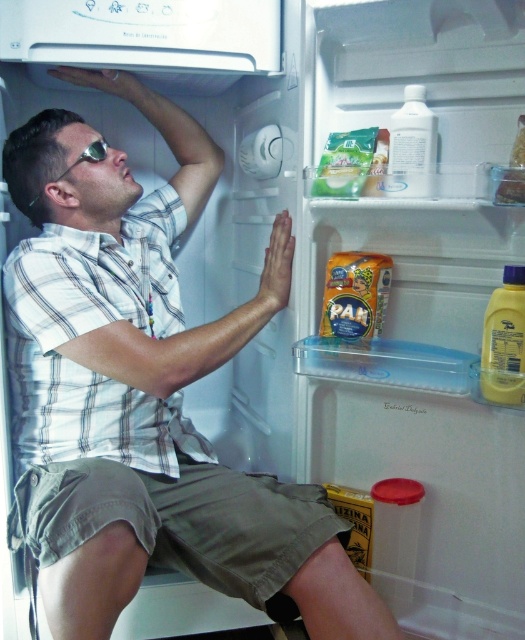
Which is in front, point (351, 276) or point (491, 358)?

Point (491, 358) is in front.

Which is more to the left, yellow matte pan at center or yellow plastic bottle at right?

yellow matte pan at center

Is point (383, 282) positioned before point (512, 394)?

No, it is not.

Locate an element on the screen. The image size is (525, 640). yellow matte pan at center is located at coordinates (355, 294).

Between point (519, 312) and point (97, 145), which one is positioned in front?

Positioned in front is point (519, 312).

Which is above, yellow plastic bottle at right or sunglasses at upper left?

sunglasses at upper left

Find the location of `yellow plastic bottle at right`. yellow plastic bottle at right is located at coordinates (505, 340).

Is point (328, 284) closer to camera compared to point (517, 182)?

No, (328, 284) is further to viewer.

Is yellow matte pan at center taller than translucent plastic container at upper right?

Incorrect, yellow matte pan at center's height is not larger of translucent plastic container at upper right's.

The height and width of the screenshot is (640, 525). What are the coordinates of `yellow matte pan at center` in the screenshot? It's located at (355, 294).